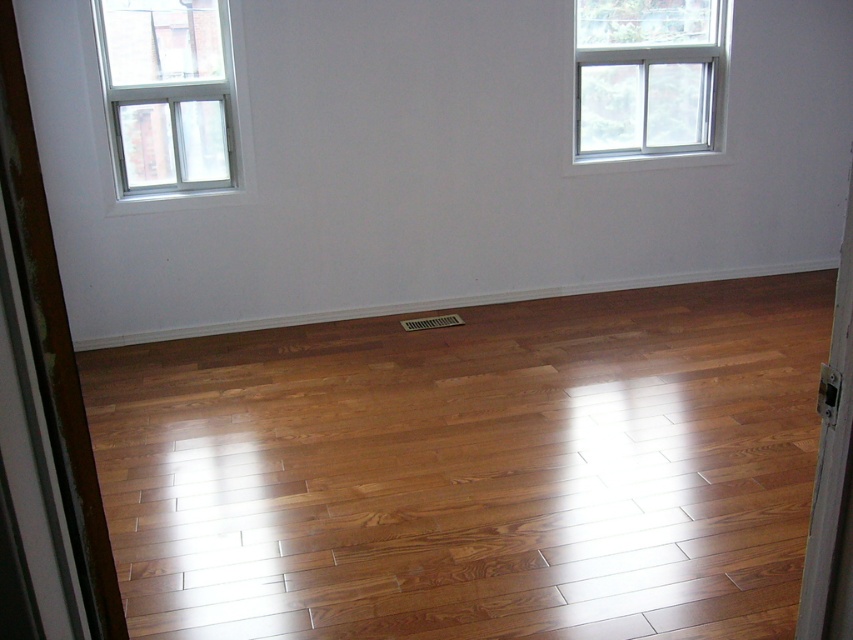
You are standing in the room and want to place a small potted plant on the floor directly under the white plastic window at upper left. Is there enough space on the shiny brown wood floor at center to place it there?

The shiny brown wood floor at center is located below the white plastic window at upper left, so there is space to place the potted plant directly under the window on the shiny brown wood floor at center.

You are a delivery person trying to determine if a large rectangular package can fit through the doorway into the room. The package measures 1.2 meters in length and 0.8 meters in width. Based on the scene, can you confirm whether the shiny brown wood floor at center and the white plastic window at upper right provide enough space for the package to pass through?

The shiny brown wood floor at center is larger in size than the white plastic window at upper right. However, the white plastic window at upper right is positioned at the upper right, so the doorway height and width must be considered. Since the package is 1.2 meters long and 0.8 meters wide, and the floor space is sufficient, the package should fit through the doorway as long as the doorway dimensions accommodate its size.